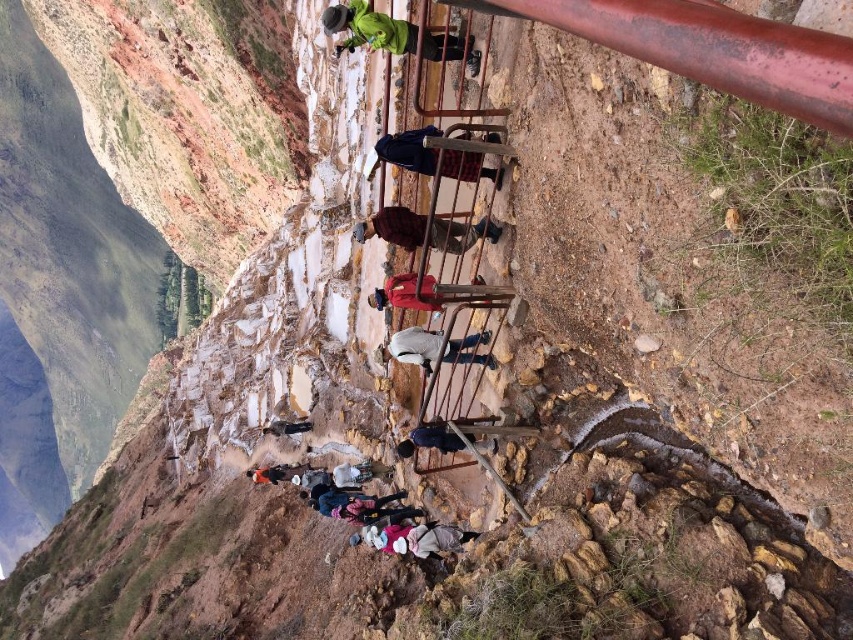
Question: Which of these objects is positioned closest to the matte pink sweater at center?

Choices:
 (A) dark gray fabric jacket at center
 (B) orange fabric bag at center
 (C) green matte jacket at upper center
 (D) brown woolen sweater at center

Answer: (D)

Question: Can you confirm if green matte jacket at upper center is smaller than dark gray fabric jacket at center?

Choices:
 (A) yes
 (B) no

Answer: (B)

Question: Which point is closer to the camera?

Choices:
 (A) (490, 292)
 (B) (282, 477)
 (C) (457, 349)

Answer: (A)

Question: Considering the relative positions of green matte jacket at upper center and brown woolen sweater at center in the image provided, where is green matte jacket at upper center located with respect to brown woolen sweater at center?

Choices:
 (A) right
 (B) left

Answer: (B)

Question: Which of the following is the closest to the observer?

Choices:
 (A) brown woolen sweater at center
 (B) dark gray fabric jacket at center
 (C) matte pink sweater at center
 (D) white fabric jacket at center

Answer: (A)

Question: Is dark blue fabric at center positioned in front of red cotton shirt at center?

Choices:
 (A) yes
 (B) no

Answer: (A)